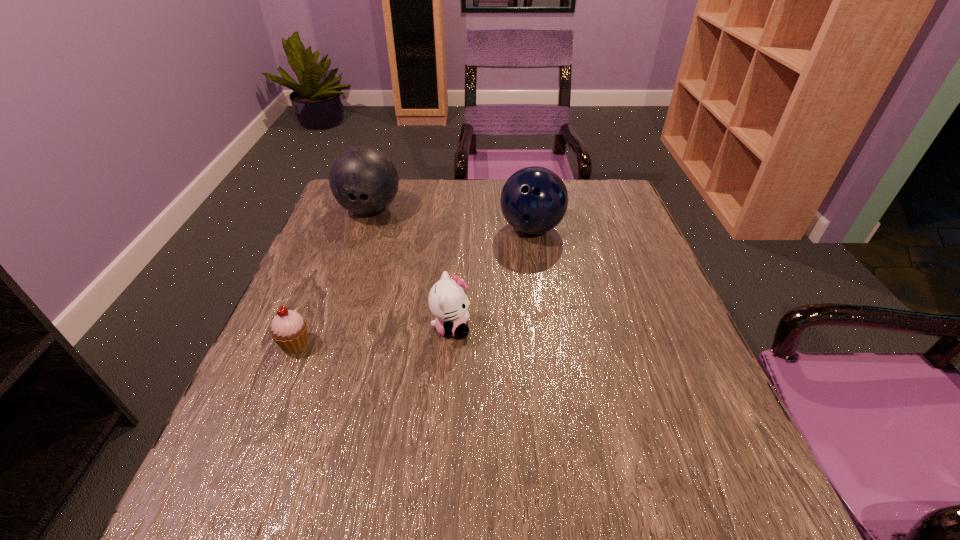
Find the location of a particular element. vacant space that satisfies the following two spatial constraints: 1. on the front-facing side of the second shortest object; 2. on the front side of the shortest object is located at coordinates (450, 344).

You are a GUI agent. You are given a task and a screenshot of the screen. Output one action in this format:
    pyautogui.click(x=<x>, y=<y>)
    Task: Click on the vacant space that satisfies the following two spatial constraints: 1. on the surface of the rightmost object near the finger holes; 2. on the front-facing side of the third tallest object
    
    Given the screenshot: What is the action you would take?
    pyautogui.click(x=546, y=328)